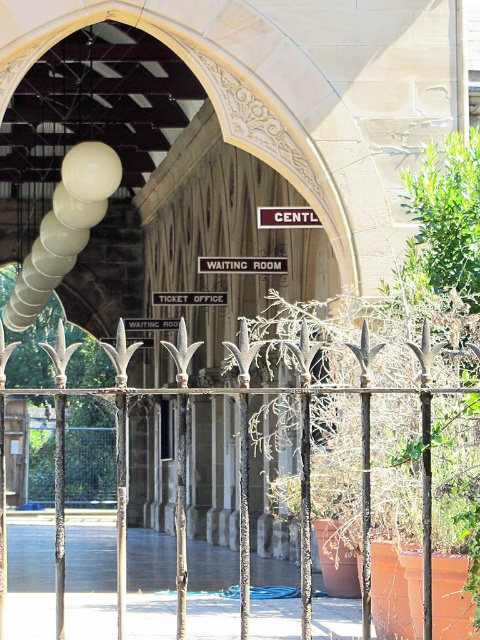
Question: Which of the following is the closest to the observer?

Choices:
 (A) (x=213, y=292)
 (B) (x=283, y=266)
 (C) (x=134, y=326)

Answer: (B)

Question: Does rusty iron fence at center lie behind brown wood sign at center?

Choices:
 (A) no
 (B) yes

Answer: (A)

Question: Is black metal sign at center above black plastic ticket office at center?

Choices:
 (A) no
 (B) yes

Answer: (B)

Question: Which object appears farthest from the camera in this image?

Choices:
 (A) rusty iron fence at center
 (B) brown wood sign at center

Answer: (B)

Question: Does black metal sign at center have a larger size compared to brown wood sign at center?

Choices:
 (A) yes
 (B) no

Answer: (B)

Question: Among these objects, which one is nearest to the camera?

Choices:
 (A) brown wood sign at center
 (B) black metal sign at center
 (C) rusty iron fence at center

Answer: (C)